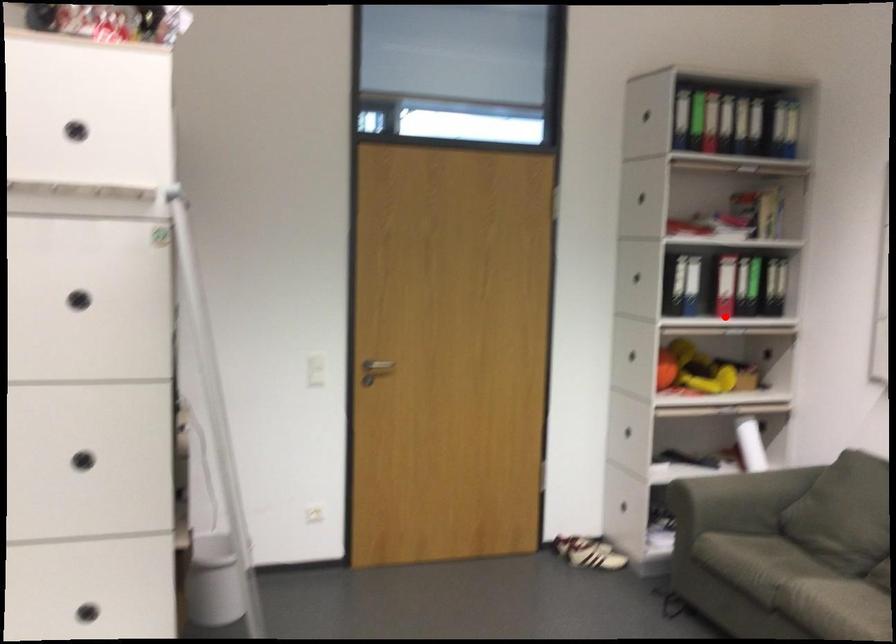
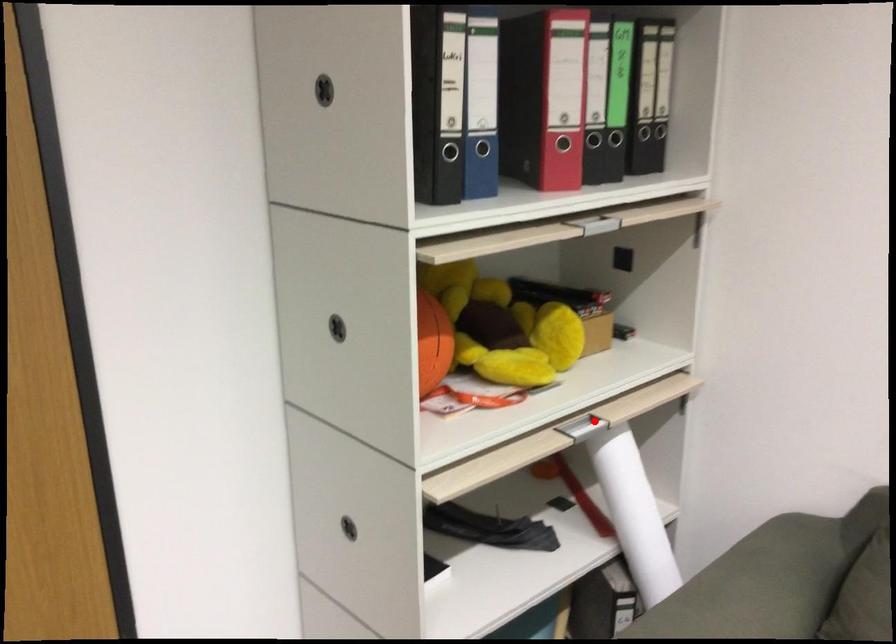
I am providing you with two images of the same scene from different viewpoints. A red point is marked on the first image and another point is marked on the second image. Is the marked point in image1 the same physical position as the marked point in image2?

No